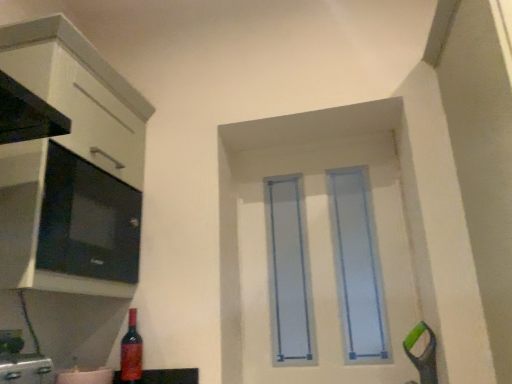
Question: From the image's perspective, is light blue plastic door at center located above shiny red glass bottle at lower left?

Choices:
 (A) yes
 (B) no

Answer: (A)

Question: From a real-world perspective, is light blue plastic door at center located higher than shiny red glass bottle at lower left?

Choices:
 (A) no
 (B) yes

Answer: (B)

Question: Is light blue plastic door at center wider than shiny red glass bottle at lower left?

Choices:
 (A) no
 (B) yes

Answer: (A)

Question: Is light blue plastic door at center not inside shiny red glass bottle at lower left?

Choices:
 (A) no
 (B) yes

Answer: (B)

Question: Does light blue plastic door at center have a smaller size compared to shiny red glass bottle at lower left?

Choices:
 (A) no
 (B) yes

Answer: (A)

Question: Looking at the image, does matte black microwave at left seem bigger or smaller compared to shiny red glass bottle at lower left?

Choices:
 (A) small
 (B) big

Answer: (B)

Question: From a real-world perspective, is matte black microwave at left above or below shiny red glass bottle at lower left?

Choices:
 (A) below
 (B) above

Answer: (B)

Question: Is matte black microwave at left wider or thinner than shiny red glass bottle at lower left?

Choices:
 (A) thin
 (B) wide

Answer: (B)

Question: From the image's perspective, is matte black microwave at left above or below shiny red glass bottle at lower left?

Choices:
 (A) above
 (B) below

Answer: (A)

Question: Does point (99, 183) appear closer or farther from the camera than point (415, 375)?

Choices:
 (A) closer
 (B) farther

Answer: (B)

Question: Is matte black microwave at left inside or outside of light blue plastic door at center?

Choices:
 (A) outside
 (B) inside

Answer: (A)

Question: Visually, is matte black microwave at left positioned to the left or to the right of light blue plastic door at center?

Choices:
 (A) right
 (B) left

Answer: (B)

Question: From the image's perspective, is matte black microwave at left located above or below light blue plastic door at center?

Choices:
 (A) above
 (B) below

Answer: (A)

Question: From the image's perspective, is shiny red glass bottle at lower left located above or below matte black microwave at left?

Choices:
 (A) above
 (B) below

Answer: (B)

Question: Considering their positions, is shiny red glass bottle at lower left located in front of or behind matte black microwave at left?

Choices:
 (A) front
 (B) behind

Answer: (B)